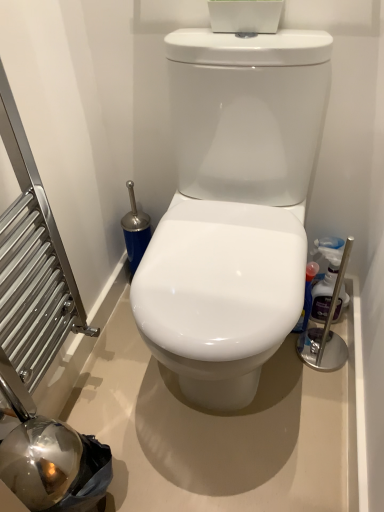
In order to click on free space in front of translucent plastic bottle at right, the 1th cleaning product viewed from the right in this screenshot , I will do `click(326, 367)`.